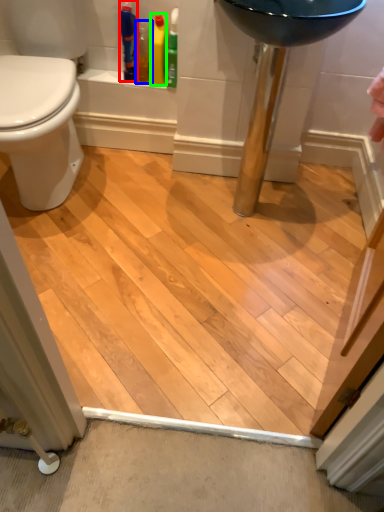
Question: Based on their relative distances, which object is farther from toiletry (highlighted by a red box)? Choose from cleaning product (highlighted by a blue box) and cleaning product (highlighted by a green box).

Choices:
 (A) cleaning product
 (B) cleaning product

Answer: (B)